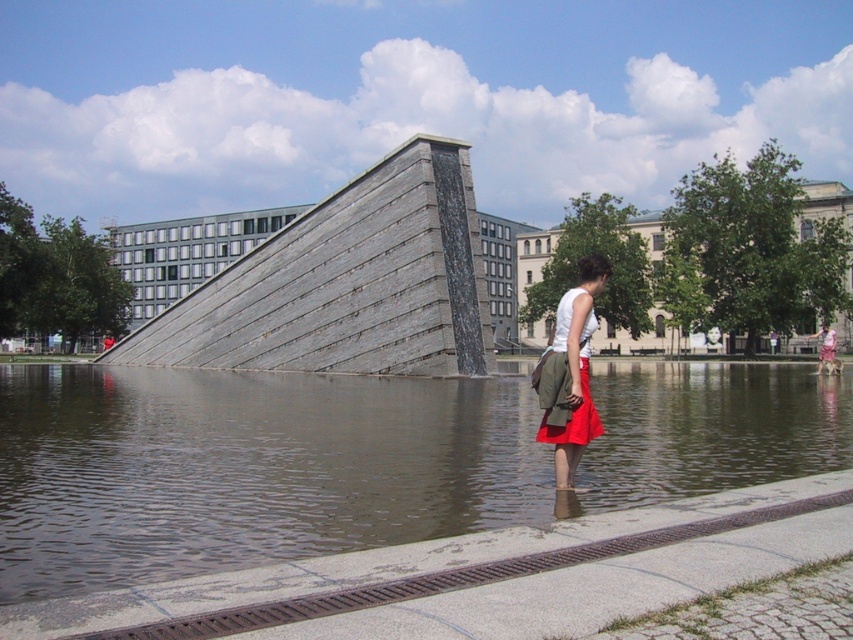
Based on the scene description, where is the brown water at center located in the image?

The brown water at center is located at point (358,460).

You are a photographer trying to capture a clear shot of the gray stone pyramid at center and the matte khaki shorts at center. Which object should you focus on first to ensure it appears sharp in the photo?

You should focus on the gray stone pyramid at center first because it is closer to the viewer than the matte khaki shorts at center, ensuring it remains sharp before adjusting focus for the other object.

You are a photographer trying to capture the entire gray stone pyramid at center and the matte khaki shorts at center in a single frame. Based on their sizes in the image, which object would require you to adjust your camera angle to include fully in the shot?

The matte khaki shorts at center occupies more space in the image than the gray stone pyramid at center, so you would need to adjust your camera angle to include the larger matte khaki shorts at center fully in the shot.